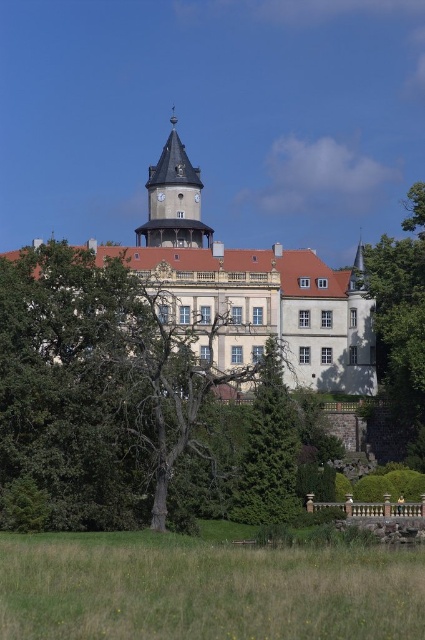
Is point (354, 365) positioned after point (254, 394)?

Yes, point (354, 365) is behind point (254, 394).

Is white stone palace at center wider than green textured tree at center?

Indeed, white stone palace at center has a greater width compared to green textured tree at center.

Does point (149, 204) lie behind point (274, 464)?

Yes, it is behind point (274, 464).

This screenshot has height=640, width=425. Identify the location of white stone palace at center. (251, 285).

Does green leafy tree at center have a larger size compared to green leafy tree at right?

Yes.

Is point (2, 314) closer to camera compared to point (416, 246)?

Yes, point (2, 314) is in front of point (416, 246).

The image size is (425, 640). What do you see at coordinates (98, 381) in the screenshot? I see `green leafy tree at center` at bounding box center [98, 381].

Identify the location of green leafy tree at center. The image size is (425, 640). point(98,381).

What do you see at coordinates (98, 381) in the screenshot? The height and width of the screenshot is (640, 425). I see `green leafy tree at center` at bounding box center [98, 381].

I want to click on green leafy tree at center, so click(x=98, y=381).

I want to click on green leafy tree at center, so pyautogui.click(x=98, y=381).